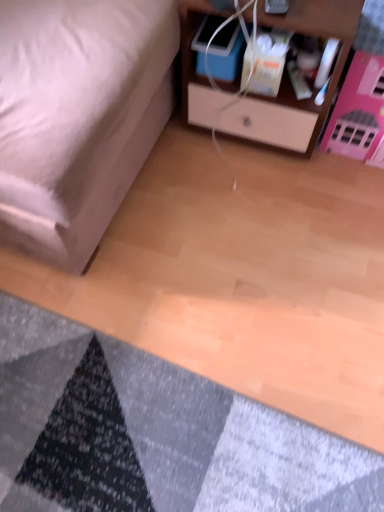
Question: In terms of height, does textured gray mat at lower left look taller or shorter compared to matte white bed at lower left?

Choices:
 (A) short
 (B) tall

Answer: (A)

Question: Looking at the image, does textured gray mat at lower left seem bigger or smaller compared to matte white bed at lower left?

Choices:
 (A) big
 (B) small

Answer: (B)

Question: Which is nearer to the textured gray mat at lower left?

Choices:
 (A) matte white bed at lower left
 (B) wooden nightstand at upper right

Answer: (A)

Question: Which of these objects is positioned farthest from the textured gray mat at lower left?

Choices:
 (A) wooden nightstand at upper right
 (B) matte white bed at lower left

Answer: (A)